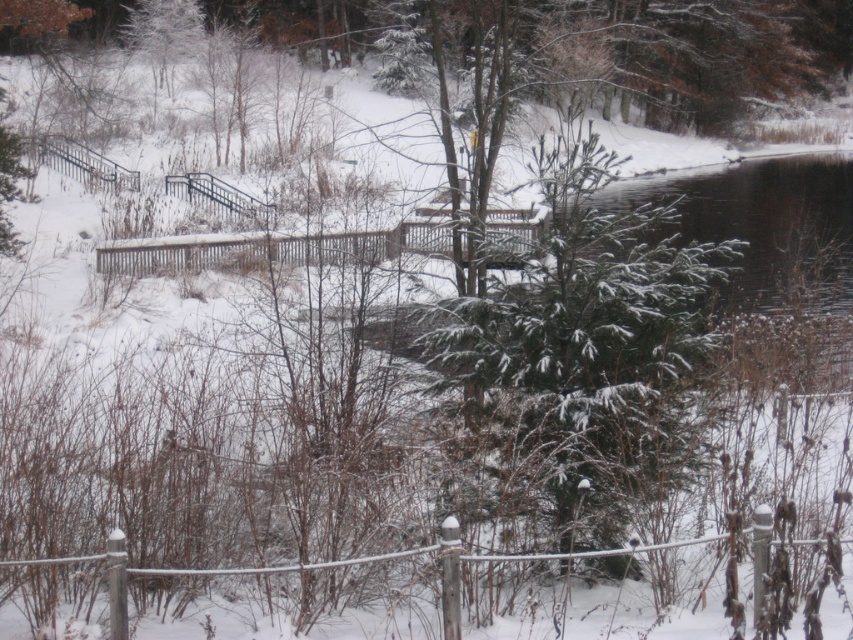
Question: Does wooden fence at center have a lesser width compared to black metal fence at upper left?

Choices:
 (A) no
 (B) yes

Answer: (A)

Question: Which object is positioned closest to the green textured evergreen tree at center?

Choices:
 (A) white wooden fence at center
 (B) black metal fence at upper left
 (C) wooden fence at center

Answer: (A)

Question: Estimate the real-world distances between objects in this image. Which object is farther from the green textured evergreen tree at center?

Choices:
 (A) wooden fence at center
 (B) white wooden fence at center

Answer: (A)

Question: Is wooden fence at center further to the viewer compared to black metal fence at upper left?

Choices:
 (A) yes
 (B) no

Answer: (B)

Question: Among these objects, which one is nearest to the camera?

Choices:
 (A) black metal fence at upper left
 (B) white wooden fence at center
 (C) green textured evergreen tree at center

Answer: (B)

Question: Is wooden fence at center to the left of white wooden fence at center from the viewer's perspective?

Choices:
 (A) no
 (B) yes

Answer: (B)